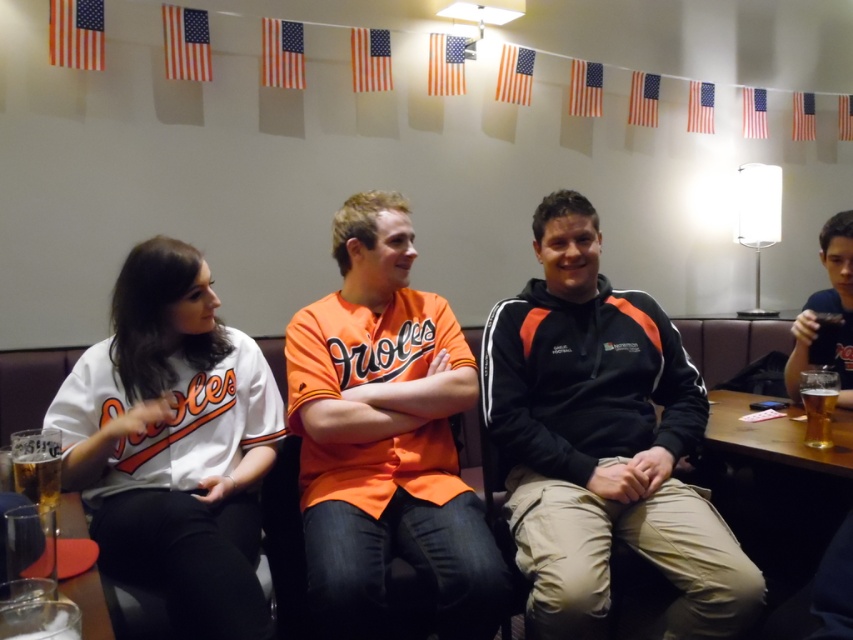
You are standing in front of the group of four people. There are two points marked in the image. One is at coordinates point (439,440) and the other is at point (50,465). Which point is closer to you?

Point (439,440) is further to the viewer than point (50,465), so the point closer to you is point (50,465).

You are standing in front of the group of four people at the bar. There are two points marked on the image, one at coordinates point (845,317) and the other at point (830,401). Which point is closer to you?

Point (845,317) is closer to you because it is further to the viewer than point (830,401).